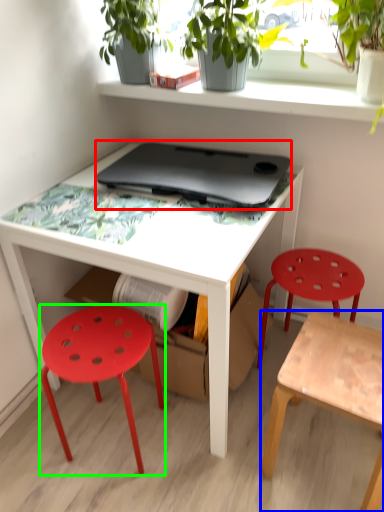
Question: Which object is the closest to the laptop (highlighted by a red box)? Choose among these: stool (highlighted by a blue box) or stool (highlighted by a green box).

Choices:
 (A) stool
 (B) stool

Answer: (B)